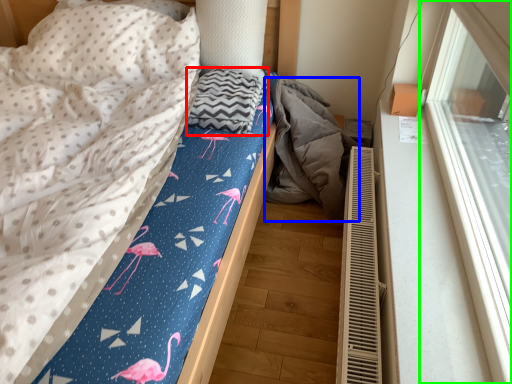
Question: Based on their relative distances, which object is nearer to blanket (highlighted by a red box)? Choose from material (highlighted by a blue box) and window (highlighted by a green box).

Choices:
 (A) material
 (B) window

Answer: (A)